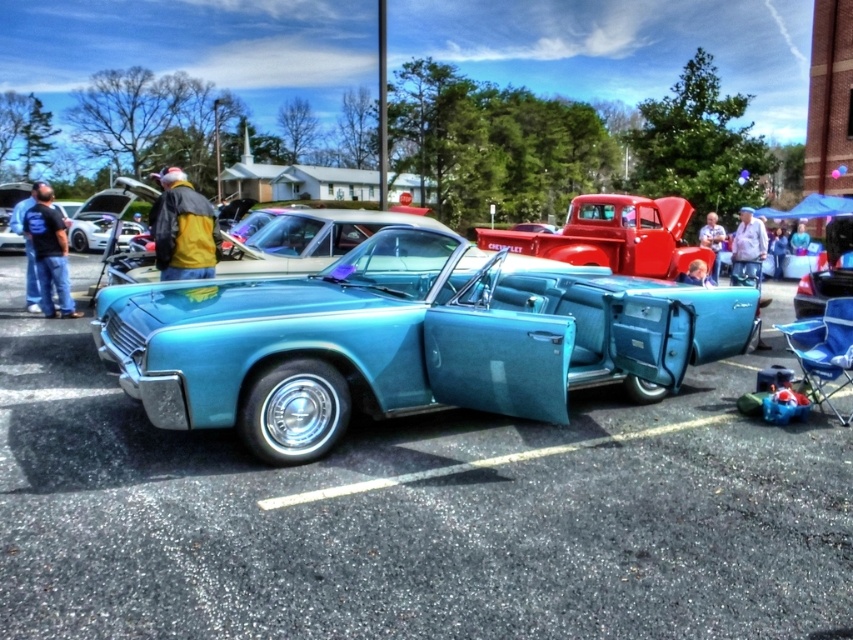
You are a parking attendant and need to fit both the teal leather convertible at center and the shiny red truck at center into a parking spot that is 3 meters wide. Based on their sizes, can both vehicles fit side by side in the spot?

The teal leather convertible at center is narrower than the shiny red truck at center. However, without knowing the exact widths of both vehicles, it is impossible to determine if their combined width will exceed the 3 meters available. Additional measurements are needed to confirm.

You are standing at the origin point of the coordinate system in the image. The teal leather convertible at center is your target. Which direction should you move to reach it?

The teal leather convertible at center is located at coordinate point 0.534 on the x axis and 0.474 on the y axis. Since you are at the origin point, you should move towards the positive x and positive y direction to reach it.